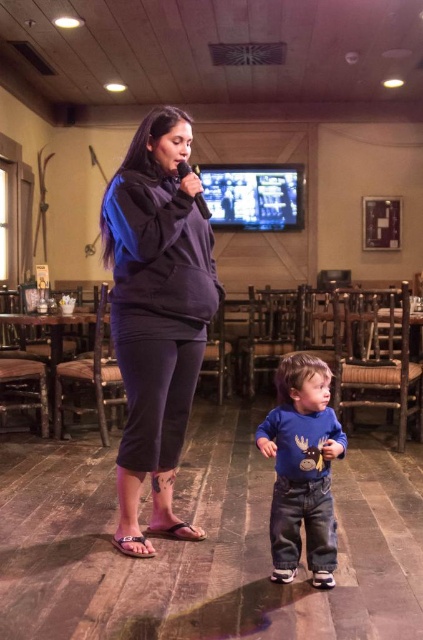
Question: Is dark gray fleece at center bigger than blue cotton shirt at lower center?

Choices:
 (A) yes
 (B) no

Answer: (A)

Question: Which object is positioned farthest from the blue cotton shirt at lower center?

Choices:
 (A) dark gray fleece at center
 (B) black matte microphone at upper center

Answer: (B)

Question: Which of the following is the closest to the observer?

Choices:
 (A) pyautogui.click(x=318, y=515)
 (B) pyautogui.click(x=189, y=118)
 (C) pyautogui.click(x=184, y=163)

Answer: (A)

Question: Does blue cotton shirt at lower center appear over black matte microphone at upper center?

Choices:
 (A) yes
 (B) no

Answer: (B)

Question: Does dark gray fleece at center have a greater width compared to black matte microphone at upper center?

Choices:
 (A) yes
 (B) no

Answer: (A)

Question: Which object is farther from the camera taking this photo?

Choices:
 (A) blue cotton shirt at lower center
 (B) black matte microphone at upper center

Answer: (B)